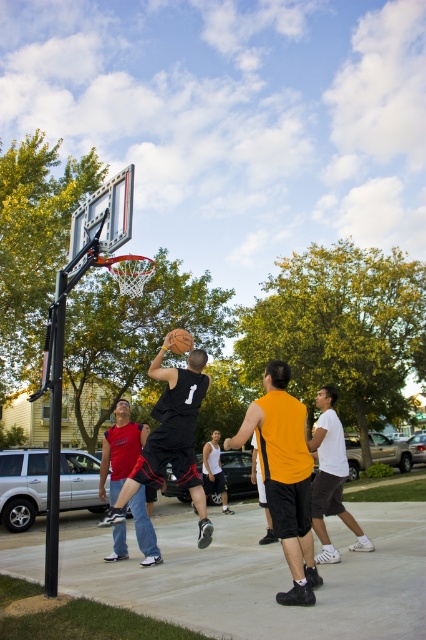
Where is the matte black basketball at center located in the image?

The matte black basketball at center is located at point coordinates of (284, 476).

You are a referee observing the basketball game. The court has a center circle marked at coordinates 0.5, 0.5. Is the black matte basketball at center located inside the center circle?

The black matte basketball at center is located at coordinates (169,442). The center circle is centered at (213,320). To determine if the ball is inside the circle, calculate the distance between the two points. The distance squared would be 0.191 squared plus 0.199 squared, which equals approximately 0.0365. The radius squared of the center circle is 0.25 squared, which is 0.0625. Since 0.0365 is less than 0.0625, the ball is inside the center circle.